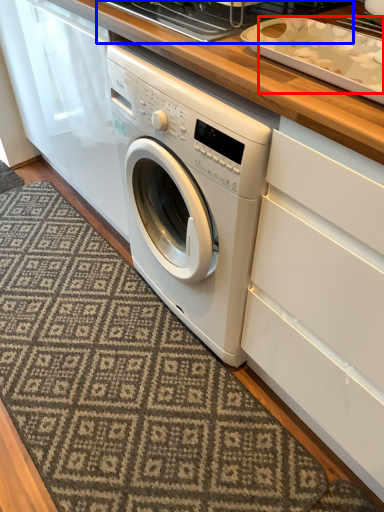
Question: Which object appears closest to the camera in this image, food (highlighted by a red box) or appliance (highlighted by a blue box)?

Choices:
 (A) food
 (B) appliance

Answer: (A)